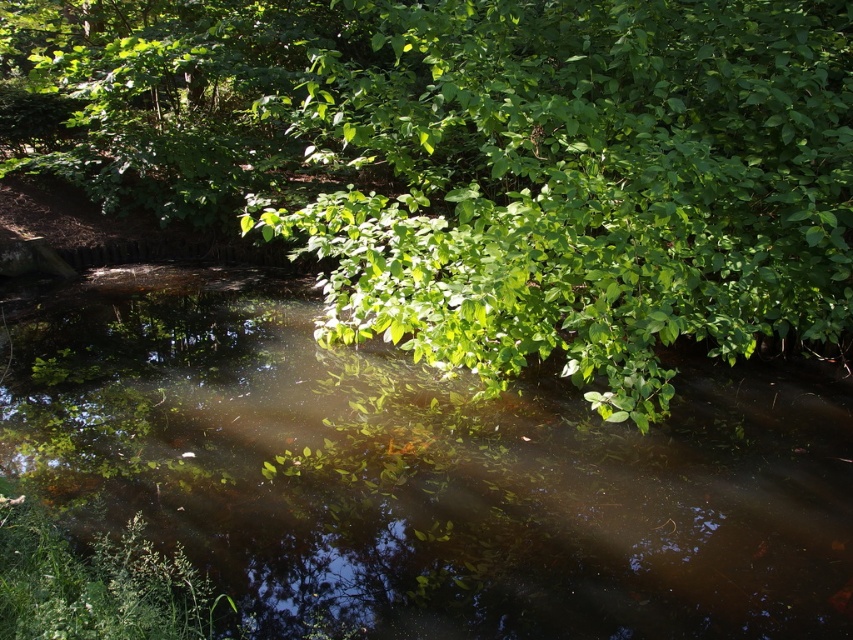
Question: Is green leafy tree at center positioned in front of clear water at center?

Choices:
 (A) no
 (B) yes

Answer: (A)

Question: Can you confirm if green leafy tree at center is thinner than clear water at center?

Choices:
 (A) yes
 (B) no

Answer: (A)

Question: Among these objects, which one is nearest to the camera?

Choices:
 (A) clear water at center
 (B) green leafy tree at center

Answer: (A)

Question: Is green leafy tree at center wider than clear water at center?

Choices:
 (A) yes
 (B) no

Answer: (B)